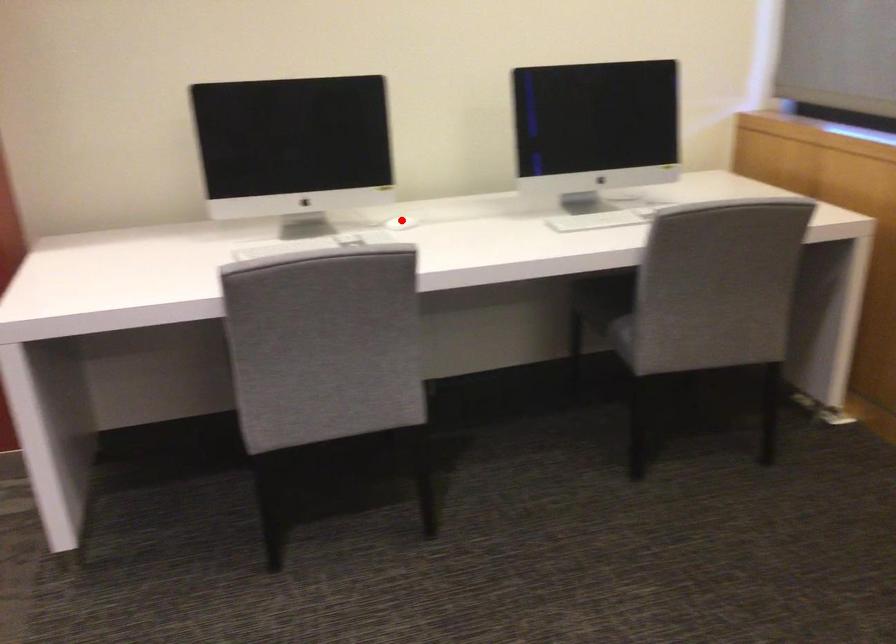
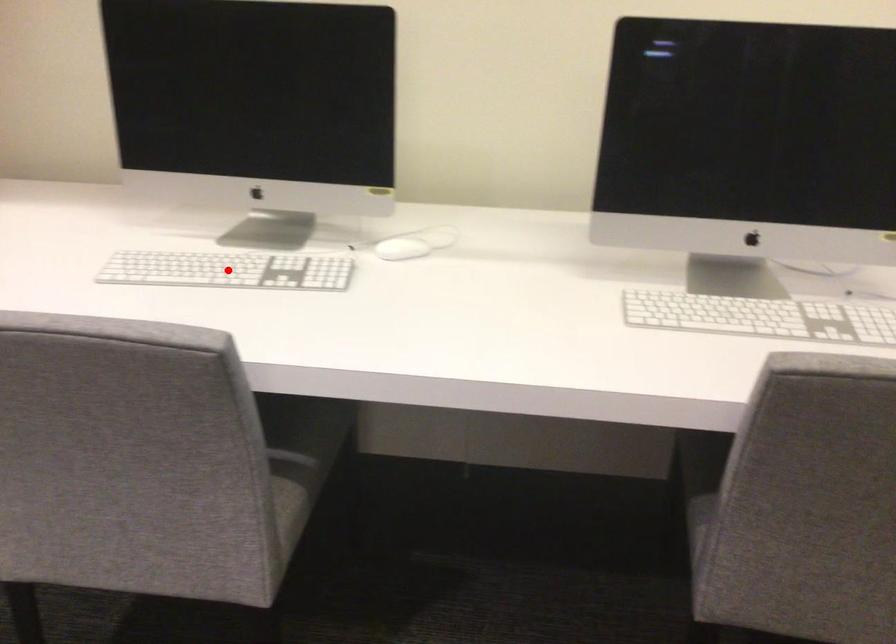
I am providing you with two images of the same scene from different viewpoints. A red point is marked on the first image and another point is marked on the second image. Are the points marked in image1 and image2 representing the same 3D position?

No